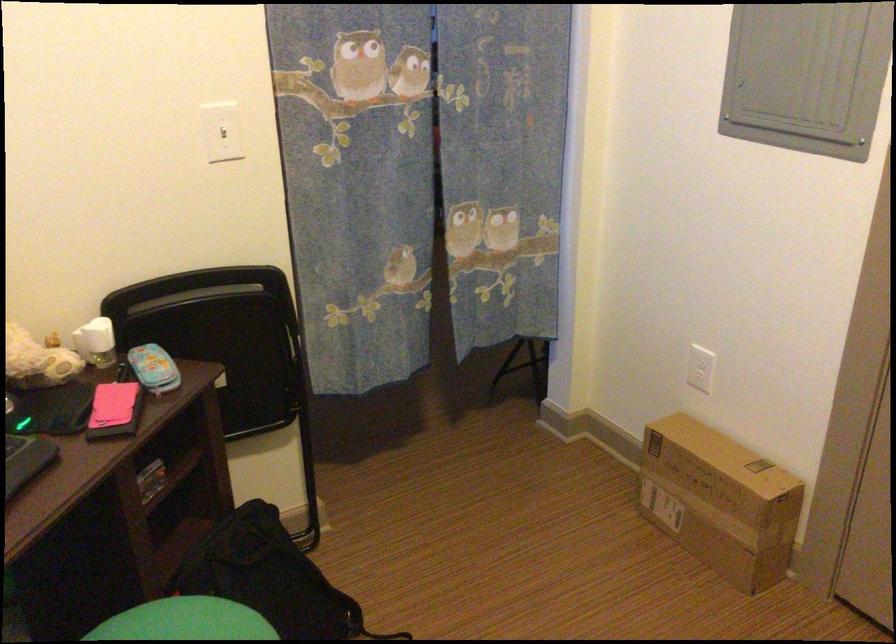
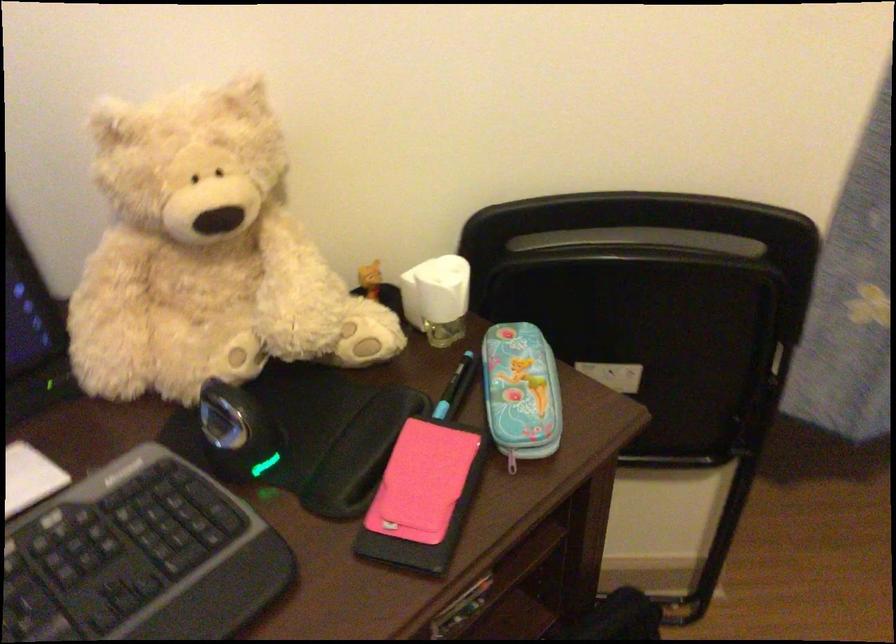
In the second image, find the point that corresponds to the point at 205,295 in the first image.

(642, 240)